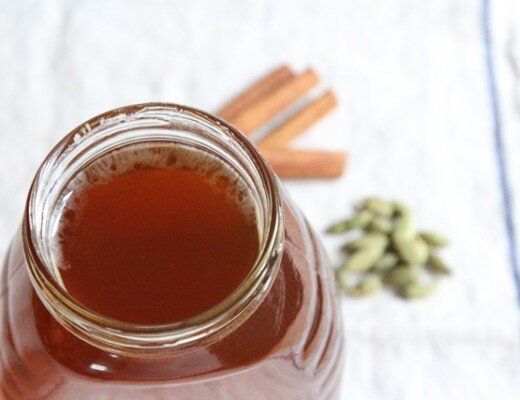
You are a GUI agent. You are given a task and a screenshot of the screen. Output one action in this format:
    pyautogui.click(x=<x>, y=<y>)
    Task: Click on the white sheet
    The width and height of the screenshot is (520, 400).
    Given the screenshot: What is the action you would take?
    pyautogui.click(x=389, y=91)